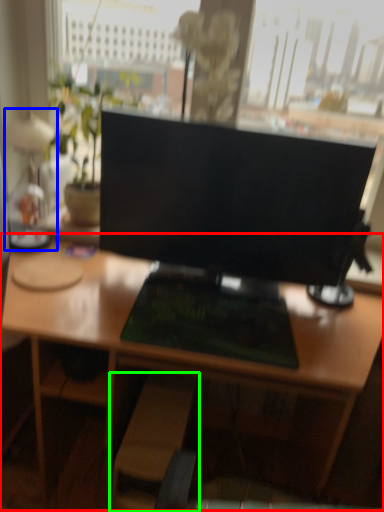
Question: Which is farther away from desk (highlighted by a red box)? table lamp (highlighted by a blue box) or swivel chair (highlighted by a green box)?

Choices:
 (A) table lamp
 (B) swivel chair

Answer: (A)